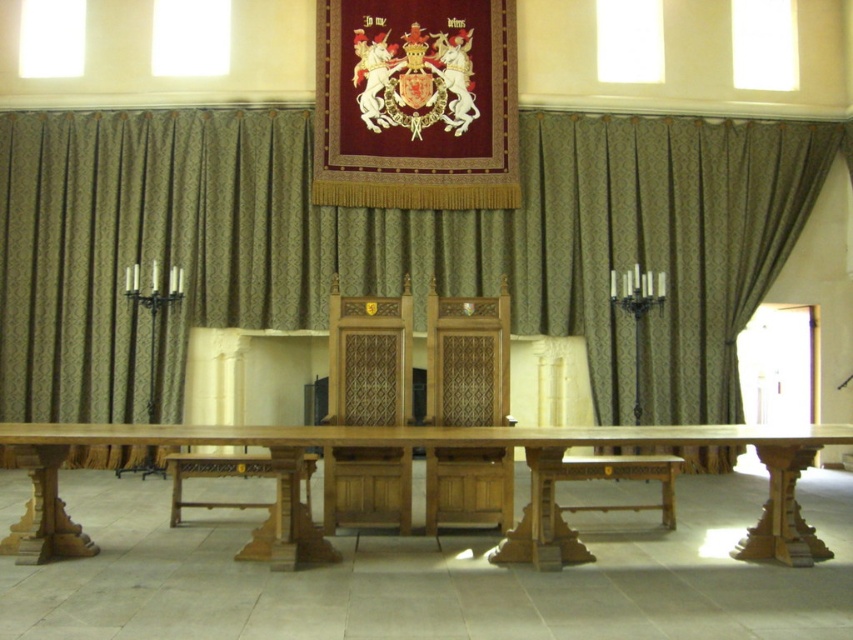
You are standing in the grand hall and need to place a large decorative centerpiece on the wooden table at center. Based on its position, where exactly should you aim to place it to ensure it is centered on the table?

The wooden table at center is located at point (x=403, y=445), so you should aim for that coordinate to center the decorative centerpiece on the table.

In the scene shown: You are planning to host a formal dinner for 10 guests in the grand hall. The wooden table at center can seat 8 people comfortably. Considering the size of the wooden chair at center, can you place an additional chair at the same size next to the existing chairs without making the seating too cramped?

The wooden table at center is bigger than the wooden chair at center, so there is enough space to add an additional wooden chair at center next to the existing chairs without overcrowding the seating area.

You are an interior designer planning to place a new rug in the grand hall. The rug must be placed between the polished wood chair at center and the wooden chair at center. Can you determine which chair is positioned higher up in the image to ensure the rug is placed appropriately?

The polished wood chair at center is above the wooden chair at center, so the rug should be placed below the polished wood chair at center to align with the lower position of the wooden chair at center.